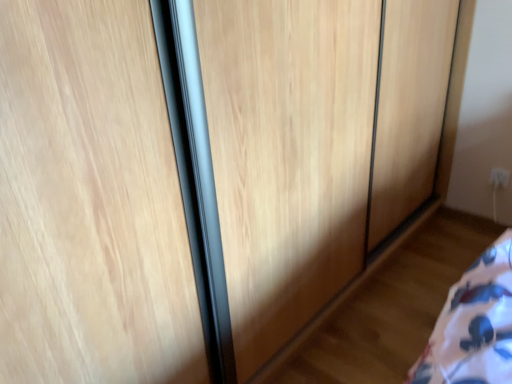
What do you see at coordinates (499, 178) in the screenshot? I see `white plastic electric outlet at upper right` at bounding box center [499, 178].

Where is `white plastic electric outlet at upper right`? The image size is (512, 384). white plastic electric outlet at upper right is located at coordinates (x=499, y=178).

I want to click on white plastic electric outlet at upper right, so click(x=499, y=178).